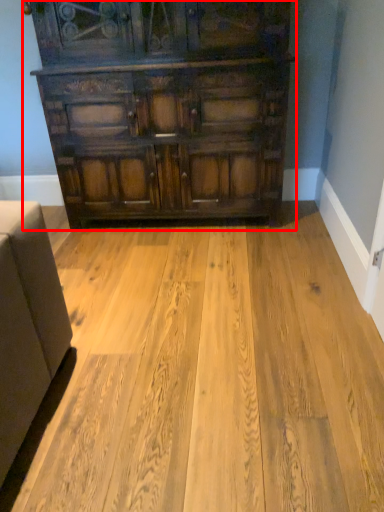
Question: From the image, what is the correct spatial relationship of chest of drawers (annotated by the red box) in relation to plywood?

Choices:
 (A) left
 (B) right

Answer: (B)